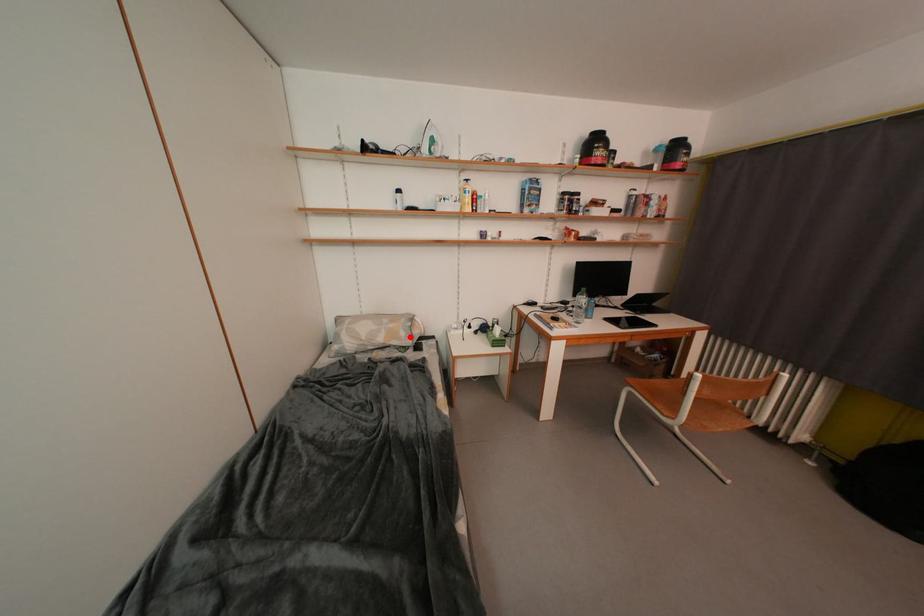
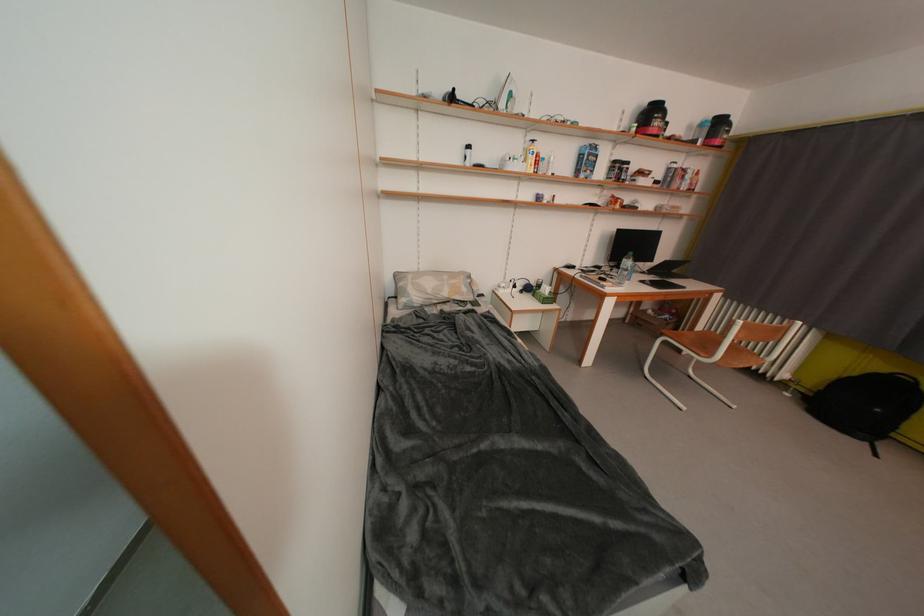
The point at the highlighted location is marked in the first image. Where is the corresponding point in the second image?

(471, 293)